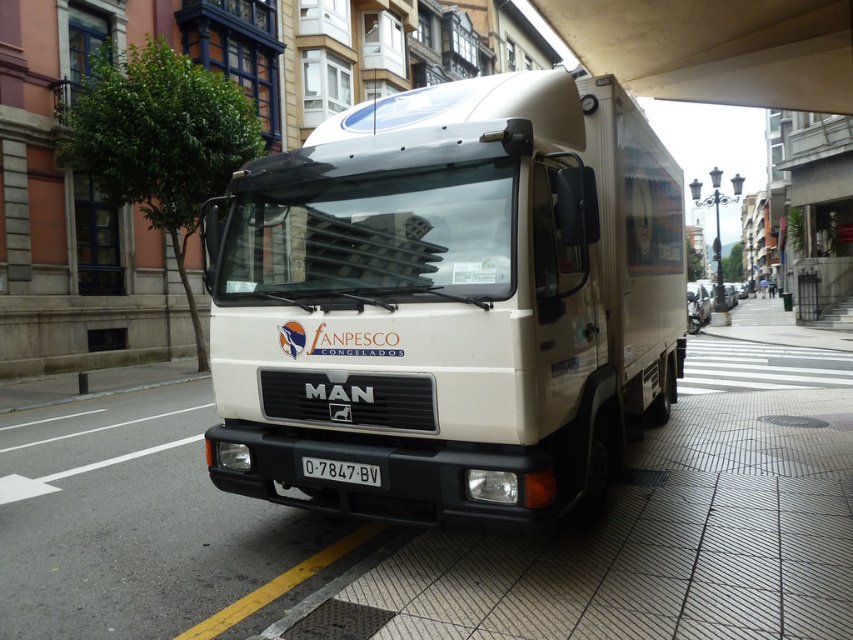
Who is shorter, white tile pavement at center or white plastic license plate at center?

white plastic license plate at center

Which is in front, point (50, 627) or point (357, 472)?

Positioned in front is point (50, 627).

Locate an element on the screen. The width and height of the screenshot is (853, 640). white tile pavement at center is located at coordinates (448, 532).

At what (x,y) coordinates should I click in order to perform the action: click on white tile pavement at center. Please return your answer as a coordinate pair (x, y). The image size is (853, 640). Looking at the image, I should click on (448, 532).

This screenshot has height=640, width=853. Identify the location of white matte truck at center. (451, 301).

Does white matte truck at center appear on the right side of white plastic license plate at center?

Indeed, white matte truck at center is positioned on the right side of white plastic license plate at center.

Does point (570, 196) come behind point (364, 472)?

No, it is not.

Find the location of `white matte truck at center`. white matte truck at center is located at coordinates (451, 301).

Which is below, white matte truck at center or white tile pavement at center?

Positioned lower is white tile pavement at center.

Is white matte truck at center bigger than white tile pavement at center?

Incorrect, white matte truck at center is not larger than white tile pavement at center.

Where is `white matte truck at center`? The width and height of the screenshot is (853, 640). white matte truck at center is located at coordinates (451, 301).

Where is `white matte truck at center`? The image size is (853, 640). white matte truck at center is located at coordinates (451, 301).